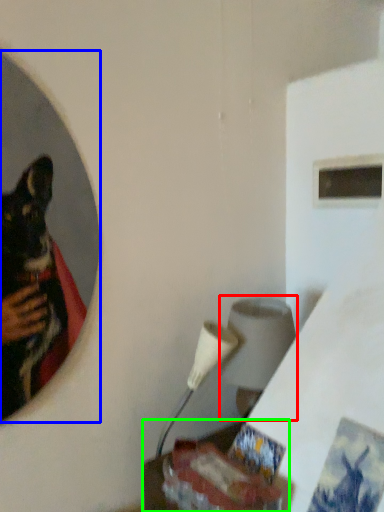
Question: Which is farther away from lamp (highlighted by a red box)? mirror (highlighted by a blue box) or table (highlighted by a green box)?

Choices:
 (A) mirror
 (B) table

Answer: (A)